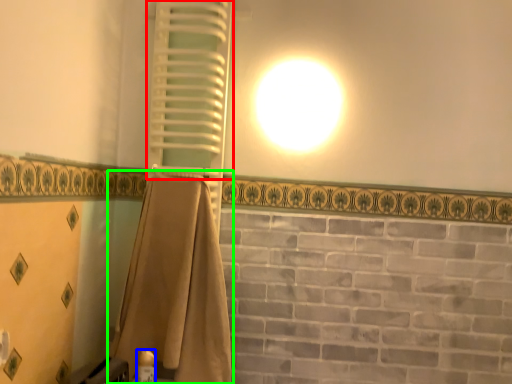
Question: Based on their relative distances, which object is nearer to shutter (highlighted by a red box)? Choose from toiletry (highlighted by a blue box) and curtain (highlighted by a green box).

Choices:
 (A) toiletry
 (B) curtain

Answer: (B)